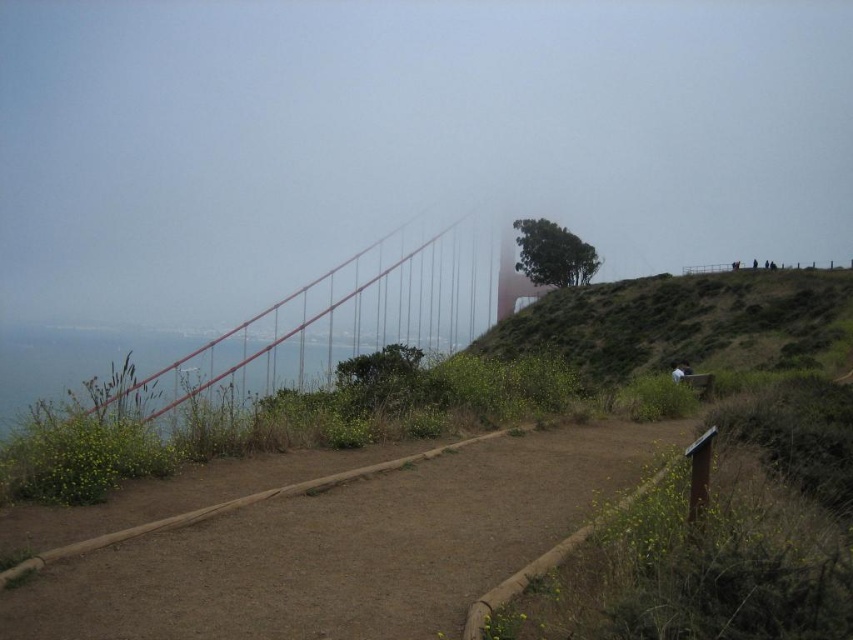
Question: Which of the following is the farthest from the observer?

Choices:
 (A) green leafy tree at upper center
 (B) green grassy hillside at upper right
 (C) brown dirt path at center
 (D) metallic red suspension bridge at center

Answer: (A)

Question: Is green grassy hillside at upper right below metallic red suspension bridge at center?

Choices:
 (A) yes
 (B) no

Answer: (B)

Question: Where is green grassy hillside at upper right located in relation to green leafy tree at upper center in the image?

Choices:
 (A) below
 (B) above

Answer: (A)

Question: Which of the following is the farthest from the observer?

Choices:
 (A) (312, 579)
 (B) (517, 240)

Answer: (B)

Question: Which of these objects is positioned farthest from the brown dirt path at center?

Choices:
 (A) green grassy hillside at upper right
 (B) metallic red suspension bridge at center

Answer: (B)

Question: Can you confirm if green grassy hillside at upper right is positioned below metallic red suspension bridge at center?

Choices:
 (A) yes
 (B) no

Answer: (B)